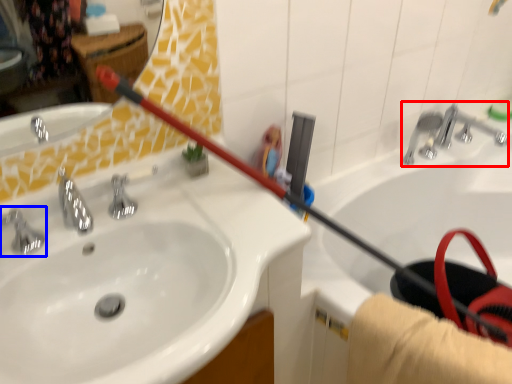
Question: Which point is further to the camera, plumbing fixture (highlighted by a red box) or tap (highlighted by a blue box)?

Choices:
 (A) plumbing fixture
 (B) tap

Answer: (A)